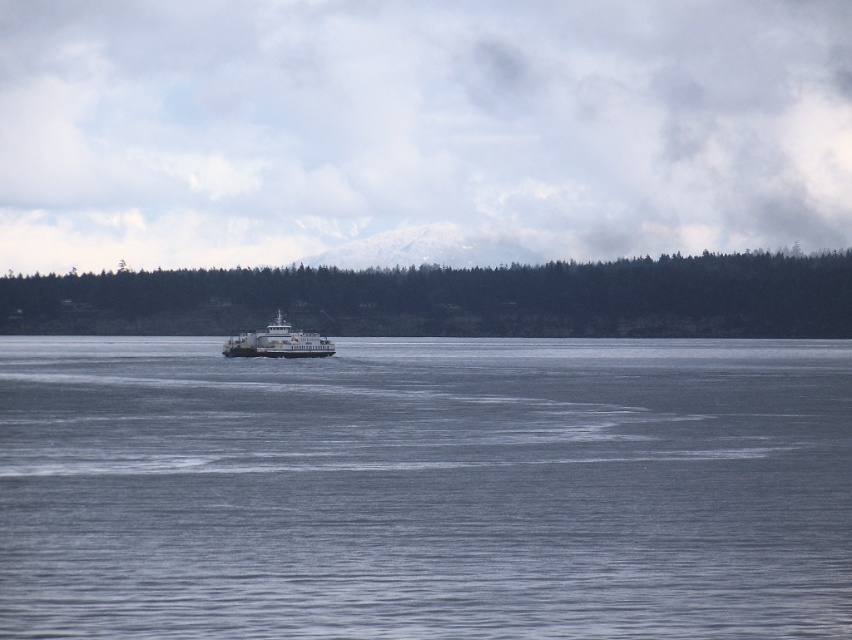
Question: Is gray water at center bigger than dark green forest at center?

Choices:
 (A) no
 (B) yes

Answer: (A)

Question: Among these objects, which one is farthest from the camera?

Choices:
 (A) gray water at center
 (B) dark green forest at center

Answer: (B)

Question: From the image, what is the correct spatial relationship of gray water at center in relation to white matte ferry at center?

Choices:
 (A) below
 (B) above

Answer: (A)

Question: Does dark green forest at center have a larger size compared to white matte ferry at center?

Choices:
 (A) no
 (B) yes

Answer: (B)

Question: Which is farther from the dark green forest at center?

Choices:
 (A) white matte ferry at center
 (B) gray water at center

Answer: (B)

Question: Among these objects, which one is nearest to the camera?

Choices:
 (A) gray water at center
 (B) dark green forest at center

Answer: (A)